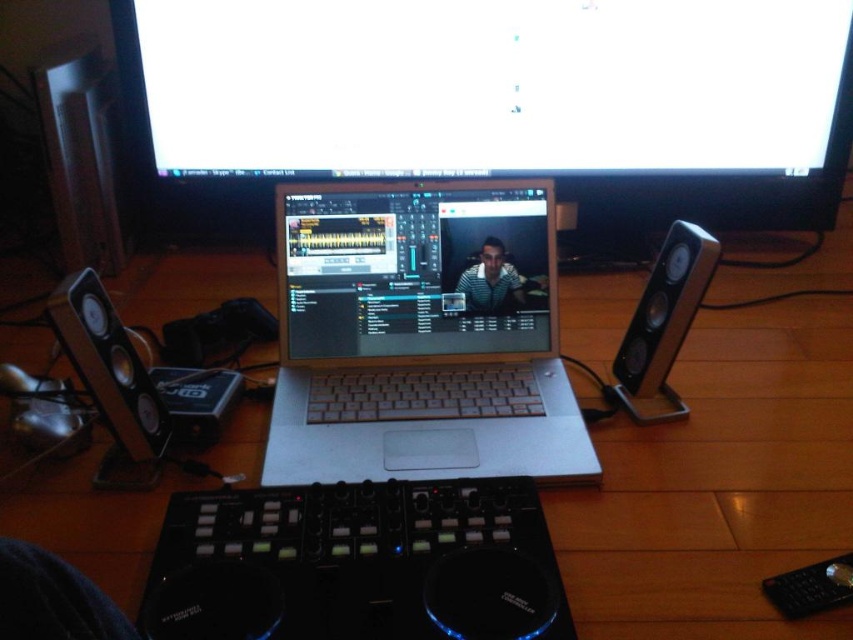
Based on the photo, you are setting up a music production studio and need to place the wooden at center and the satin black laptop at center. According to the scene, which object is located to the right of the other?

The wooden at center is positioned on the right side of the satin black laptop at center, so the wooden at center is to the right of the satin black laptop at center.

You are a music producer setting up your studio. You have a matte black monitor at upper center and a satin black laptop at center. Which device is positioned higher in the image?

The matte black monitor at upper center is located above the satin black laptop at center, so it is positioned higher in the image.

You are a music producer setting up your studio. You have two points marked in your setup area. The first point is at coordinates point [726,244] and the second is at point [158,436]. Based on the scene description, which point is further back from the front of the studio?

Point [726,244] is behind point [158,436], so the first point is further back from the front of the studio.